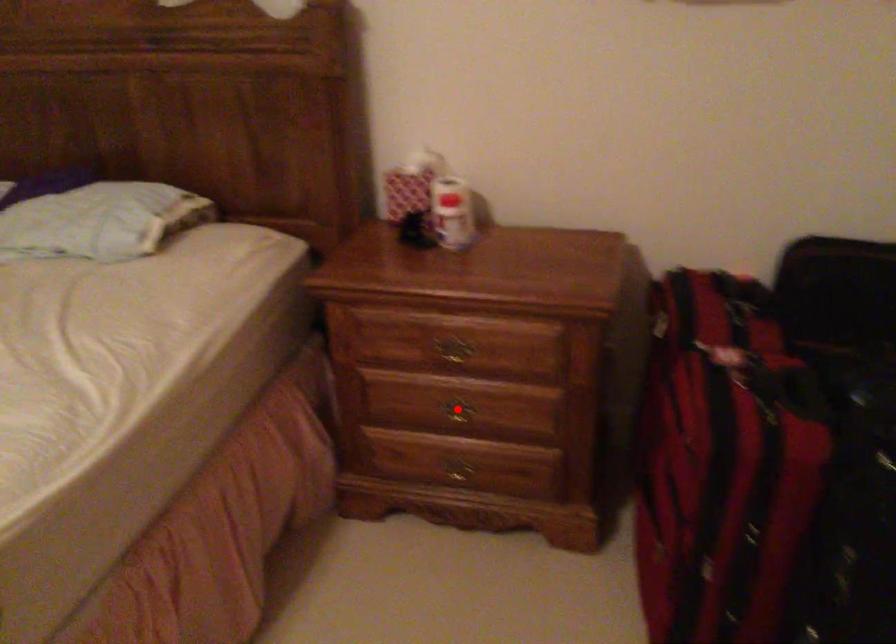
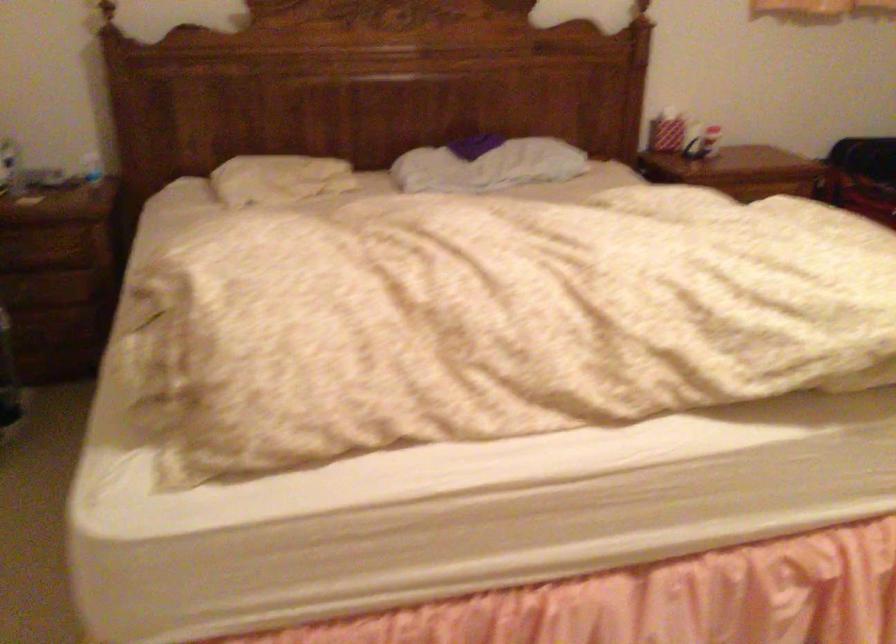
Question: I am providing you with two images of the same scene from different viewpoints. A red point is marked on the first image. Can you still see the location of the red point in image 2?

Choices:
 (A) Yes
 (B) No

Answer: (B)